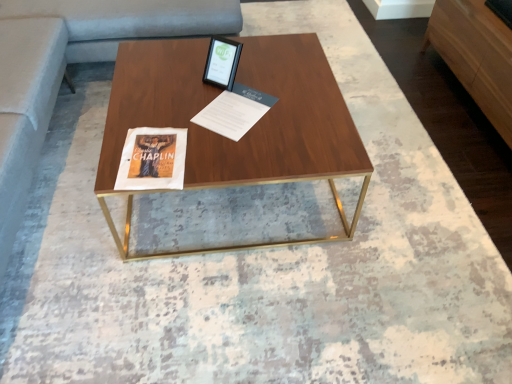
Locate an element on the screen. The height and width of the screenshot is (384, 512). vacant space to the left of white paper at center is located at coordinates (170, 106).